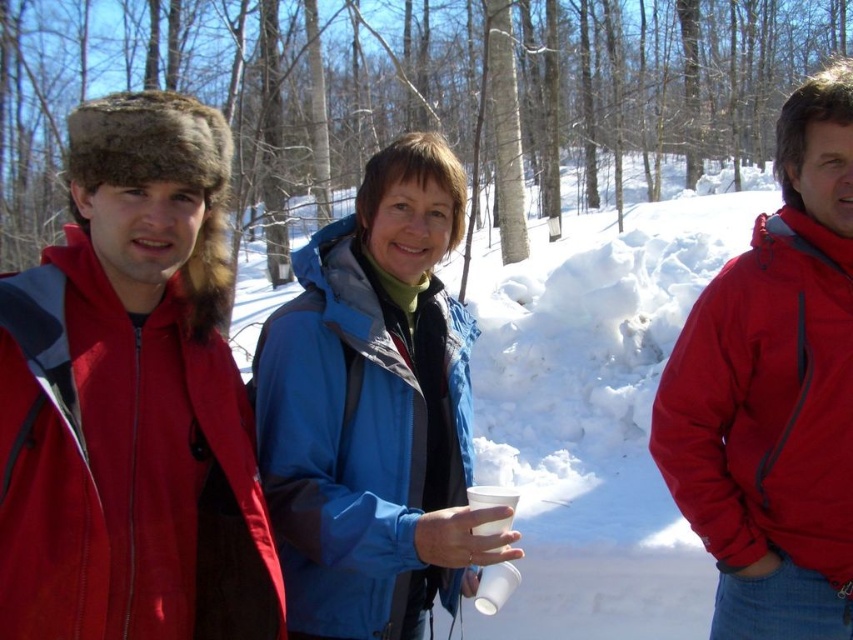
You are a GUI agent. You are given a task and a screenshot of the screen. Output one action in this format:
    pyautogui.click(x=<x>, y=<y>)
    Task: Click on the fuzzy fur hat at left
    The image size is (853, 640).
    Given the screenshot: What is the action you would take?
    pyautogui.click(x=132, y=400)

Does fuzzy fur hat at left have a lesser width compared to blue softshell jacket at center?

Yes.

Who is more distant from viewer, [151,621] or [289,552]?

Point [289,552]

At what (x,y) coordinates should I click in order to perform the action: click on fuzzy fur hat at left. Please return your answer as a coordinate pair (x, y). The height and width of the screenshot is (640, 853). Looking at the image, I should click on (132, 400).

Is blue softshell jacket at center closer to the viewer compared to matte red jacket at right?

Yes.

Does blue softshell jacket at center appear on the left side of matte red jacket at right?

Indeed, blue softshell jacket at center is positioned on the left side of matte red jacket at right.

The width and height of the screenshot is (853, 640). Find the location of `blue softshell jacket at center`. blue softshell jacket at center is located at coordinates (374, 412).

Measure the distance between fuzzy fur hat at left and camera.

A distance of 2.64 meters exists between fuzzy fur hat at left and camera.

Is fuzzy fur hat at left to the left of matte red jacket at right from the viewer's perspective?

Indeed, fuzzy fur hat at left is positioned on the left side of matte red jacket at right.

Measure the distance between fuzzy fur hat at left and camera.

fuzzy fur hat at left and camera are 2.64 meters apart.

At what (x,y) coordinates should I click in order to perform the action: click on fuzzy fur hat at left. Please return your answer as a coordinate pair (x, y). The height and width of the screenshot is (640, 853). Looking at the image, I should click on (132, 400).